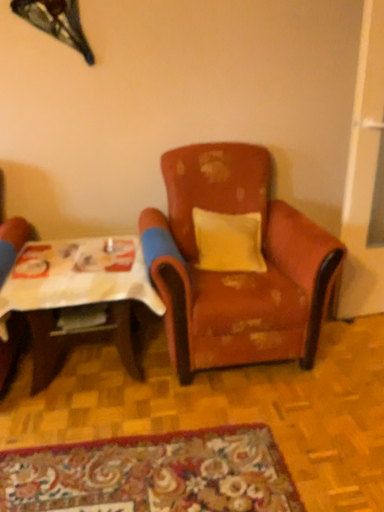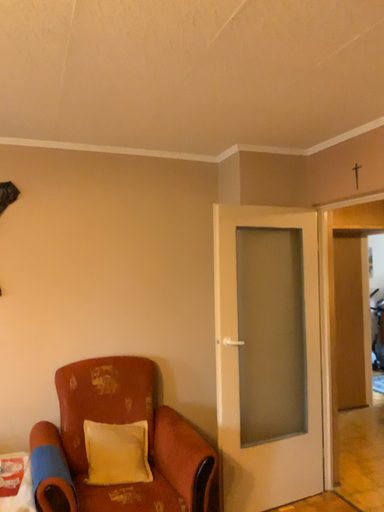
Question: Which way did the camera rotate in the video?

Choices:
 (A) rotated upward
 (B) rotated downward

Answer: (A)